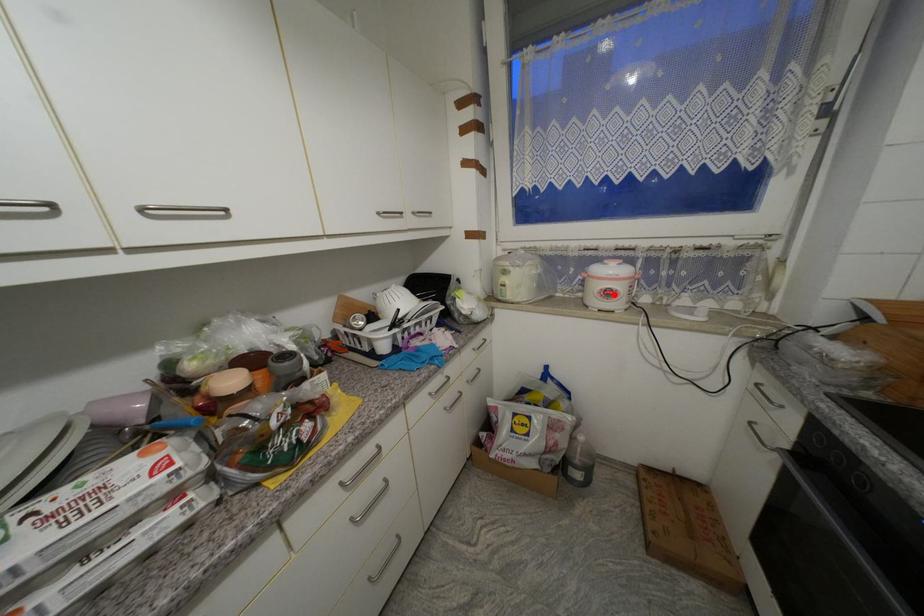
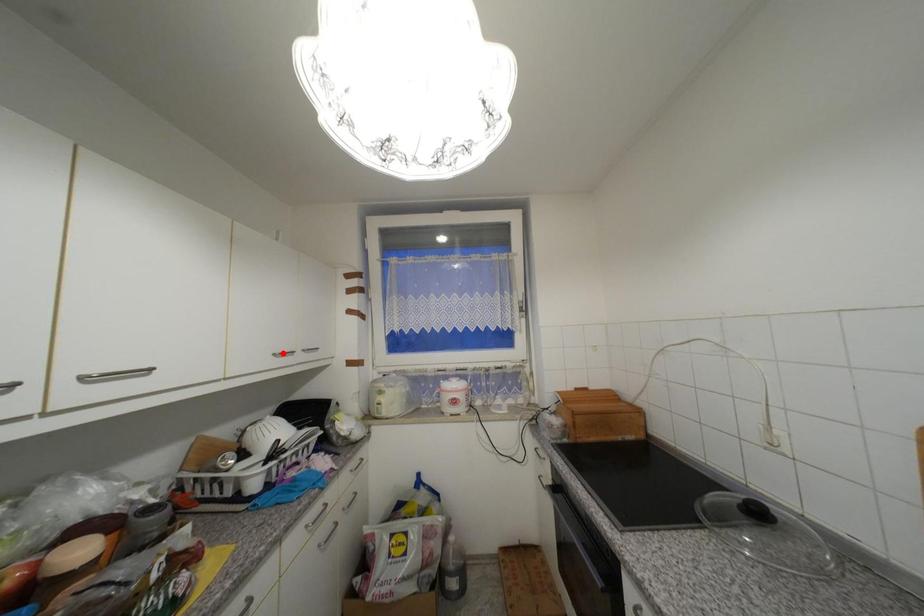
I am providing you with two images of the same scene from different viewpoints. A red point is marked on the first image and another point is marked on the second image. Is the red point in image1 aligned with the point shown in image2?

No